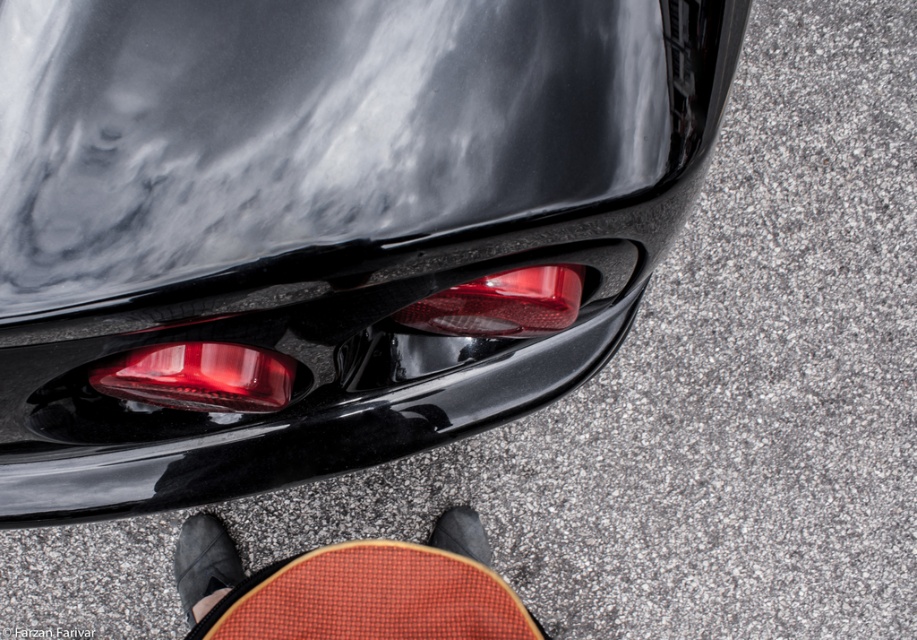
Question: Is glossy black taillight at center to the right of black suede shoe at lower center from the viewer's perspective?

Choices:
 (A) no
 (B) yes

Answer: (B)

Question: Is glossy black taillight at center to the left of textured brown skateboard at lower center from the viewer's perspective?

Choices:
 (A) no
 (B) yes

Answer: (B)

Question: Which point is closer to the camera?

Choices:
 (A) glossy red tail light at center
 (B) glossy black taillight at center
 (C) black leather shoe at lower center
 (D) textured brown skateboard at lower center

Answer: (B)

Question: Does glossy red tail light at center appear over black suede shoe at lower center?

Choices:
 (A) yes
 (B) no

Answer: (A)

Question: Among these objects, which one is farthest from the camera?

Choices:
 (A) glossy black taillight at center
 (B) textured brown skateboard at lower center
 (C) glossy red tail light at center
 (D) black suede shoe at lower center

Answer: (D)

Question: Which point is farther to the camera?

Choices:
 (A) matte red tail light at lower left
 (B) black leather shoe at lower center
 (C) glossy red tail light at center

Answer: (B)